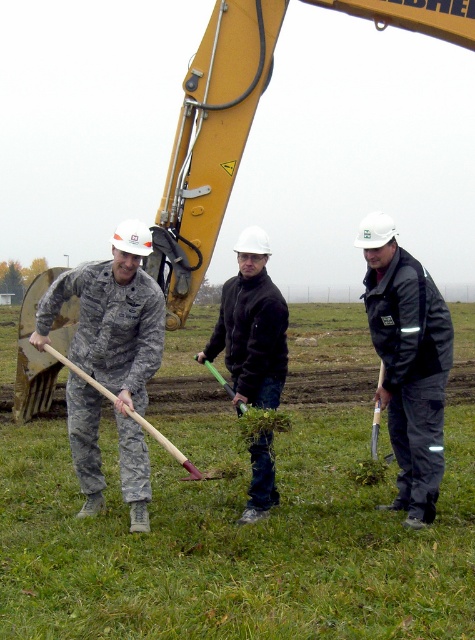
You are standing at the point labeled as point (229, 388). You want to walk towards the point labeled as point (101, 388). In which direction should you move?

You should move forward because point (101, 388) is in front of point (229, 388).

You are a construction worker needing to choose a shovel to dig a deep hole. Which shovel, the wooden handle shovel at left or the green plastic shovel at center, would you select based on their heights?

The wooden handle shovel at left is taller than the green plastic shovel at center, so you should choose the wooden handle shovel at left for digging a deep hole since it likely has a longer handle for better leverage.